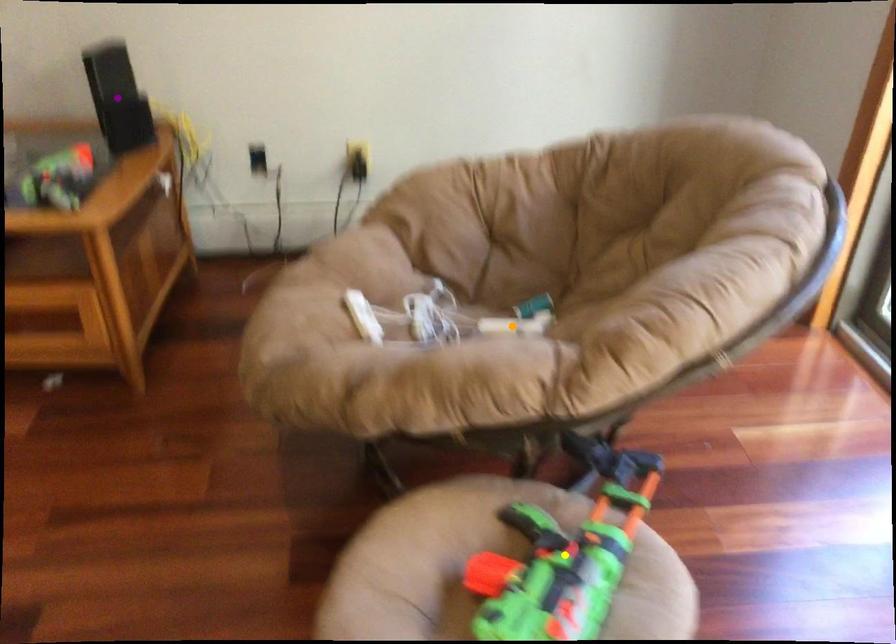
Order these from nearest to farthest:
- orange point
- purple point
- yellow point

yellow point
orange point
purple point